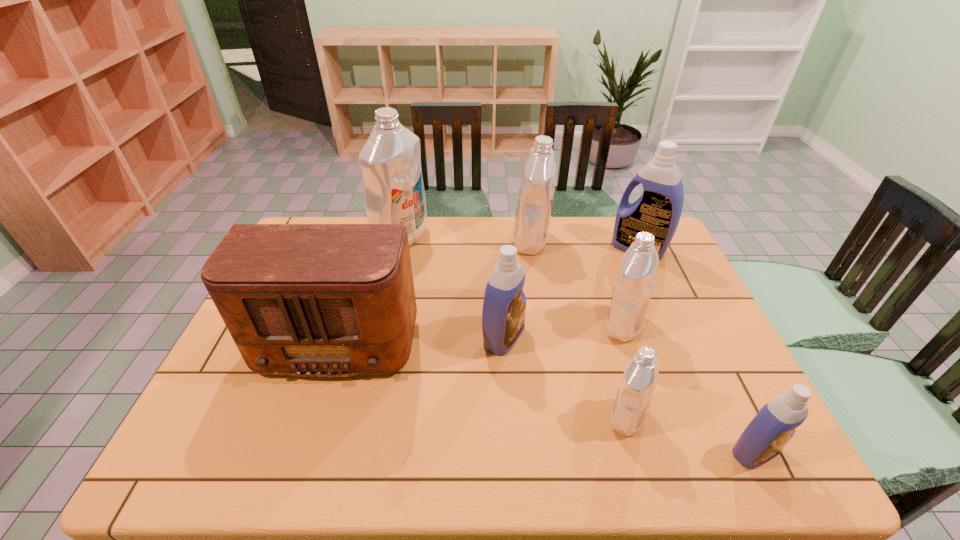
You are a GUI agent. You are given a task and a screenshot of the screen. Output one action in this format:
    pyautogui.click(x=<x>, y=<y>)
    Task: Click on the leftmost detergent
    The height and width of the screenshot is (540, 960).
    Given the screenshot: What is the action you would take?
    pyautogui.click(x=390, y=161)

The width and height of the screenshot is (960, 540). Find the location of `the biggest white detergent`. the biggest white detergent is located at coordinates (390, 161).

I want to click on the second white detergent from left to right, so click(536, 192).

Locate an element on the screen. the biggest blue detergent is located at coordinates (658, 211).

Identify the location of brown radio receiver. Image resolution: width=960 pixels, height=540 pixels. (311, 300).

You are a GUI agent. You are given a task and a screenshot of the screen. Output one action in this format:
    pyautogui.click(x=<x>, y=<y>)
    Task: Click on the third biggest white detergent
    
    Given the screenshot: What is the action you would take?
    pyautogui.click(x=634, y=284)

Identify the location of the second nearest blue detergent. (503, 316).

You are a GUI agent. You are given a task and a screenshot of the screen. Output one action in this format:
    pyautogui.click(x=<x>, y=<y>)
    Task: Click on the second biggest blue detergent
    Image resolution: width=960 pixels, height=540 pixels.
    Given the screenshot: What is the action you would take?
    pos(503,316)

At what (x,y) coordinates should I click in order to perform the action: click on the nearest white detergent. Please return your answer as a coordinate pair (x, y). This screenshot has width=960, height=540. Looking at the image, I should click on (636, 389).

Where is `the smallest blue detergent`? the smallest blue detergent is located at coordinates click(x=763, y=439).